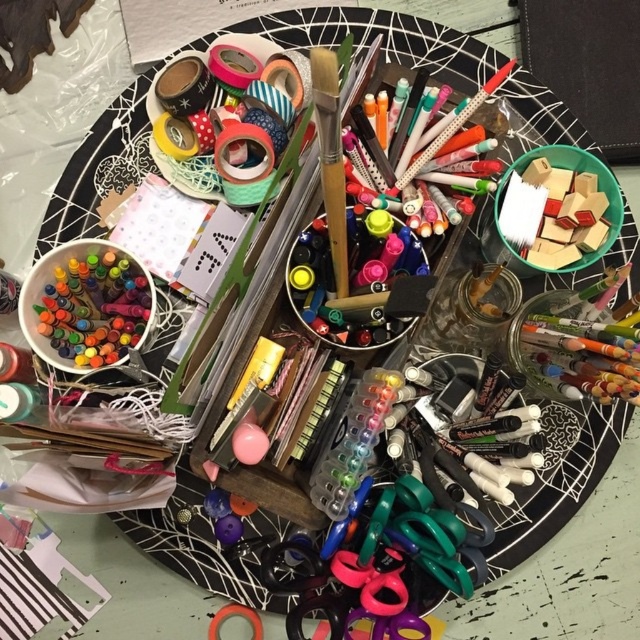
Question: Is matte plastic crayons at left in front of wooden blocks at upper right?

Choices:
 (A) yes
 (B) no

Answer: (A)

Question: Does wooden paintbrush at center have a larger size compared to wooden blocks at upper right?

Choices:
 (A) no
 (B) yes

Answer: (B)

Question: Which point appears closest to the camera in this image?

Choices:
 (A) (116, 356)
 (B) (595, 160)
 (C) (333, 250)

Answer: (C)

Question: Which object is positioned farthest from the matte plastic crayons at left?

Choices:
 (A) wooden paintbrush at center
 (B) wooden blocks at upper right

Answer: (B)

Question: Is matte black markers at center in front of wooden blocks at upper right?

Choices:
 (A) no
 (B) yes

Answer: (B)

Question: Which object is positioned farthest from the matte black markers at center?

Choices:
 (A) wooden paintbrush at center
 (B) matte plastic crayons at left

Answer: (B)